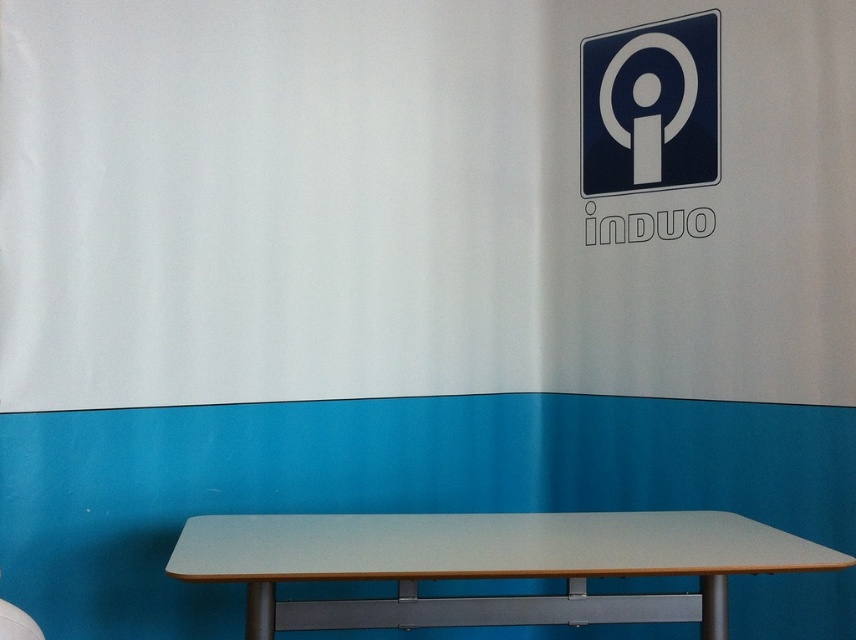
Is point (545, 621) closer to viewer compared to point (682, 173)?

Yes, it is in front of point (682, 173).

Between light gray laminate table at center and blue glossy sign at upper right, which one appears on the right side from the viewer's perspective?

From the viewer's perspective, blue glossy sign at upper right appears more on the right side.

What do you see at coordinates (486, 564) in the screenshot?
I see `light gray laminate table at center` at bounding box center [486, 564].

Identify the location of light gray laminate table at center. Image resolution: width=856 pixels, height=640 pixels. (486, 564).